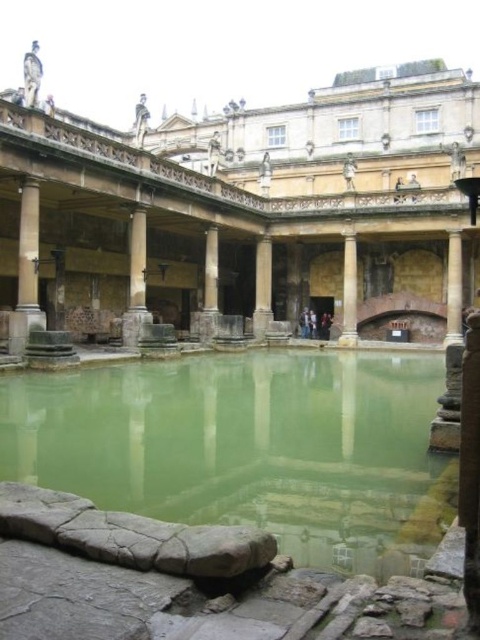
Question: Which point appears farthest from the camera in this image?

Choices:
 (A) 21,296
 (B) 340,339
 (C) 264,243
 (D) 277,541

Answer: (C)

Question: Which object is farther from the camera taking this photo?

Choices:
 (A) smooth stone pillar at center
 (B) smooth stone pillar at left
 (C) gray stone pillar at center

Answer: (C)

Question: Is smooth stone pillar at center positioned at the back of gray stone pillar at center?

Choices:
 (A) yes
 (B) no

Answer: (B)

Question: Does green stone water at center appear over gray stone pillar at center?

Choices:
 (A) no
 (B) yes

Answer: (A)

Question: Which object is the farthest from the green stone water at center?

Choices:
 (A) gray stone pillar at center
 (B) smooth stone pillar at left
 (C) white marble pillar at center

Answer: (C)

Question: In this image, where is smooth stone pillar at left located relative to white marble pillar at center?

Choices:
 (A) below
 (B) above

Answer: (B)